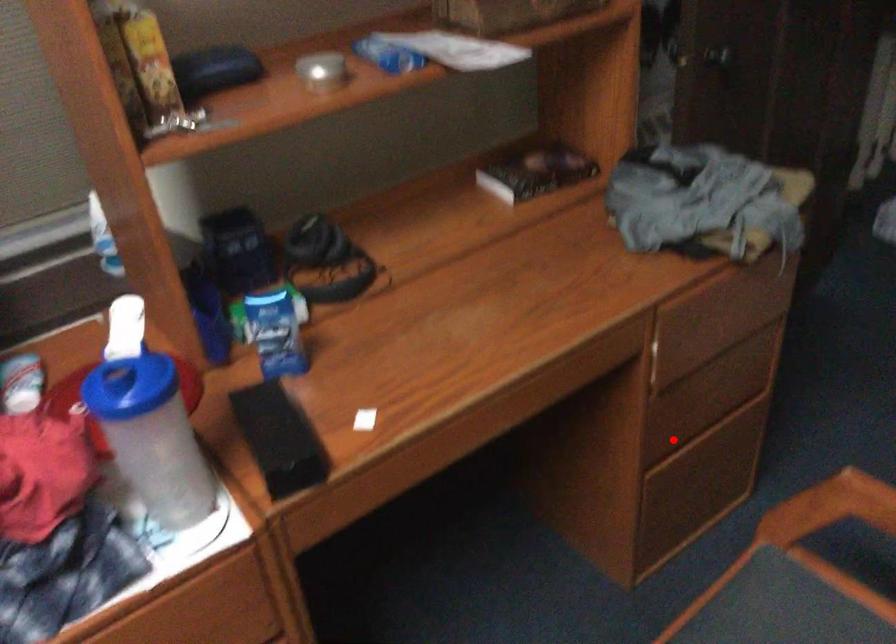
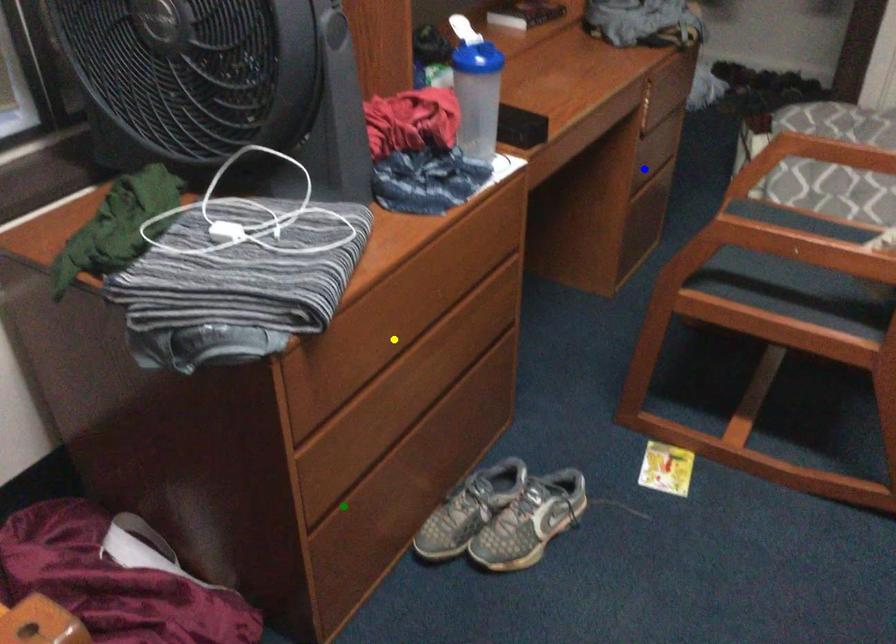
Question: I am providing you with two images of the same scene from different viewpoints. A red point is marked on the first image. You are given multiple points on the second image. In image 2, which mark is for the same physical point as the one in image 1?

Choices:
 (A) yellow point
 (B) blue point
 (C) green point

Answer: (B)